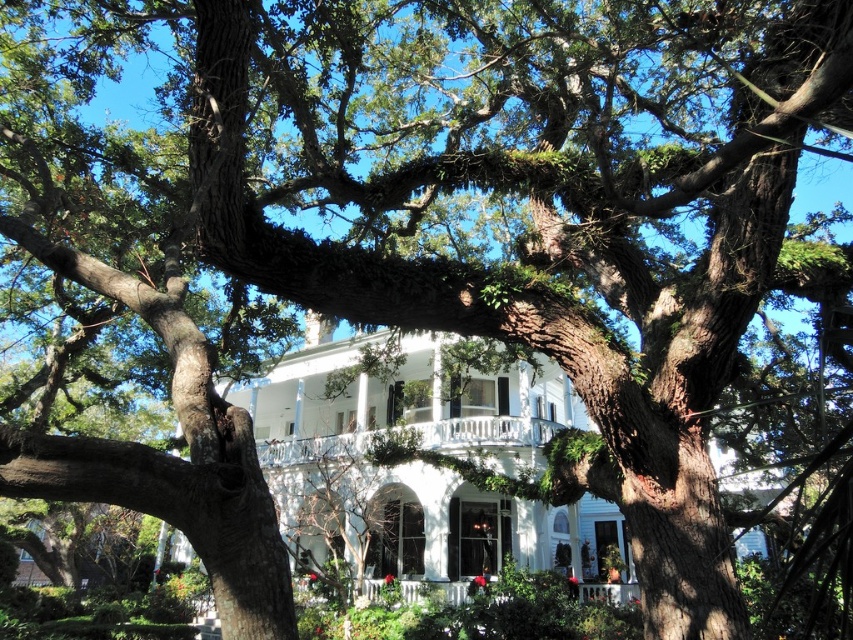
Does white painted wood porch at center have a larger size compared to white wooden porch at center?

Yes.

Who is more distant from viewer, (518, 420) or (358, 598)?

Point (518, 420)

Identify the location of white painted wood porch at center. (482, 432).

Is point (294, 365) closer to camera compared to point (444, 424)?

No, it is not.

From the picture: Between white glossy mansion at center and white painted wood porch at center, which one has more height?

white glossy mansion at center is taller.

Image resolution: width=853 pixels, height=640 pixels. I want to click on white glossy mansion at center, so click(311, 419).

Locate an element on the screen. The width and height of the screenshot is (853, 640). white glossy mansion at center is located at coordinates (311, 419).

Does white glossy mansion at center have a smaller size compared to white wooden porch at center?

Incorrect, white glossy mansion at center is not smaller in size than white wooden porch at center.

Who is taller, white glossy mansion at center or white wooden porch at center?

white glossy mansion at center

Does point (503, 554) come closer to viewer compared to point (352, 582)?

No, (503, 554) is further to viewer.

Where is `white glossy mansion at center`? The height and width of the screenshot is (640, 853). white glossy mansion at center is located at coordinates (311, 419).